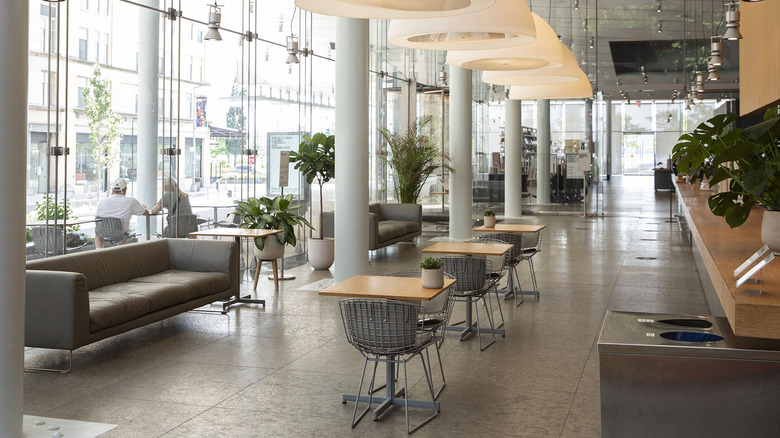
What are the coordinates of `potted plant` in the screenshot? It's located at (271, 218), (314, 157), (417, 159), (752, 175), (431, 267), (488, 218).